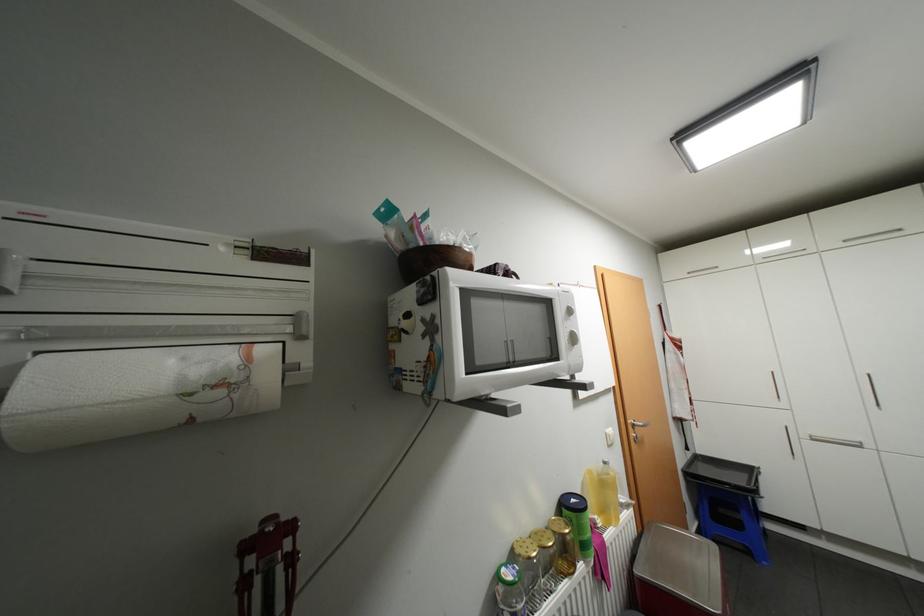
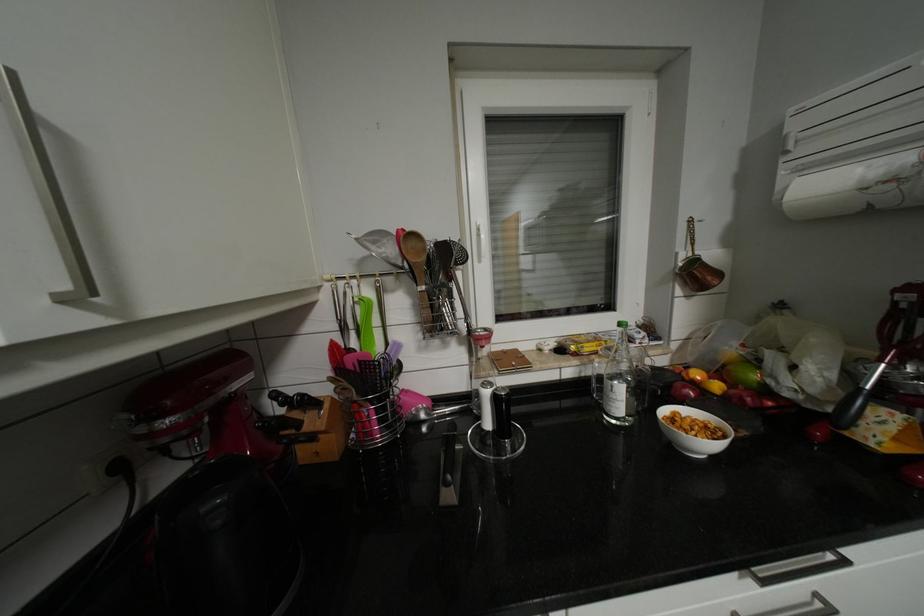
Locate, in the second image, the point that corresponds to (x=228, y=391) in the first image.

(898, 185)